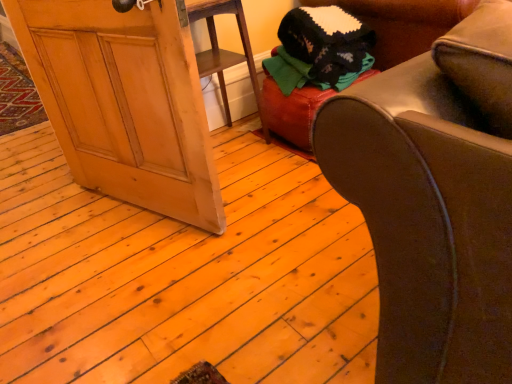
The height and width of the screenshot is (384, 512). In order to click on free space on the front side of wooden screen door at lower left in this screenshot , I will do `click(140, 293)`.